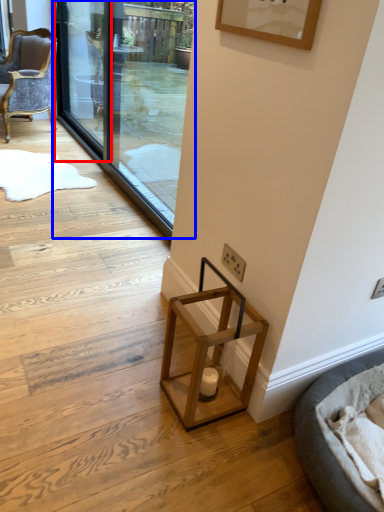
Question: Among these objects, which one is nearest to the camera, screen door (highlighted by a red box) or screen door (highlighted by a blue box)?

Choices:
 (A) screen door
 (B) screen door

Answer: (B)